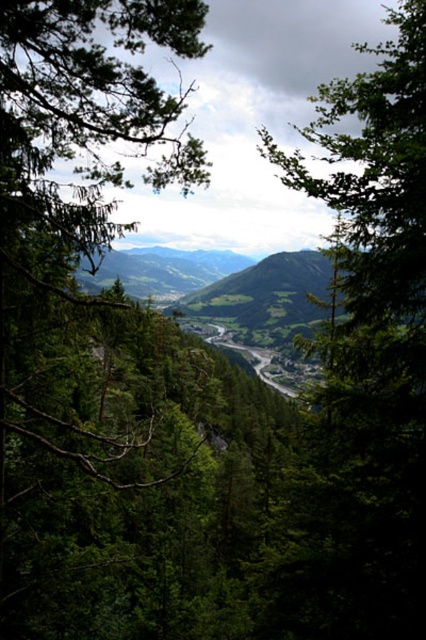
You are a hiker standing at the edge of the valley looking towards the dense forest. You notice two green leafy trees in the foreground. Which tree, the green leafy tree at center or the green leafy tree at left, appears closer to you based on their positions?

The green leafy tree at center appears closer because it is positioned over the green leafy tree at left, indicating it is in front.